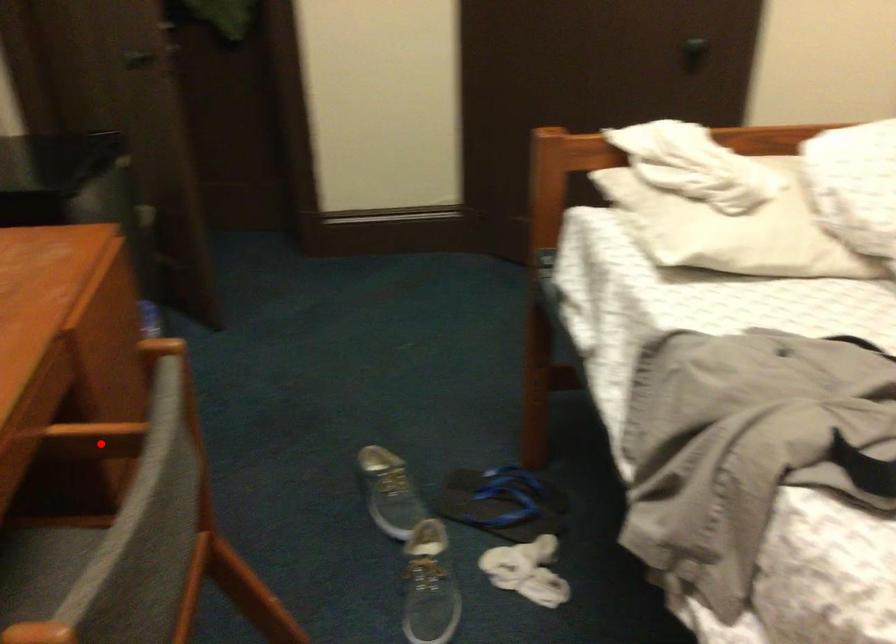
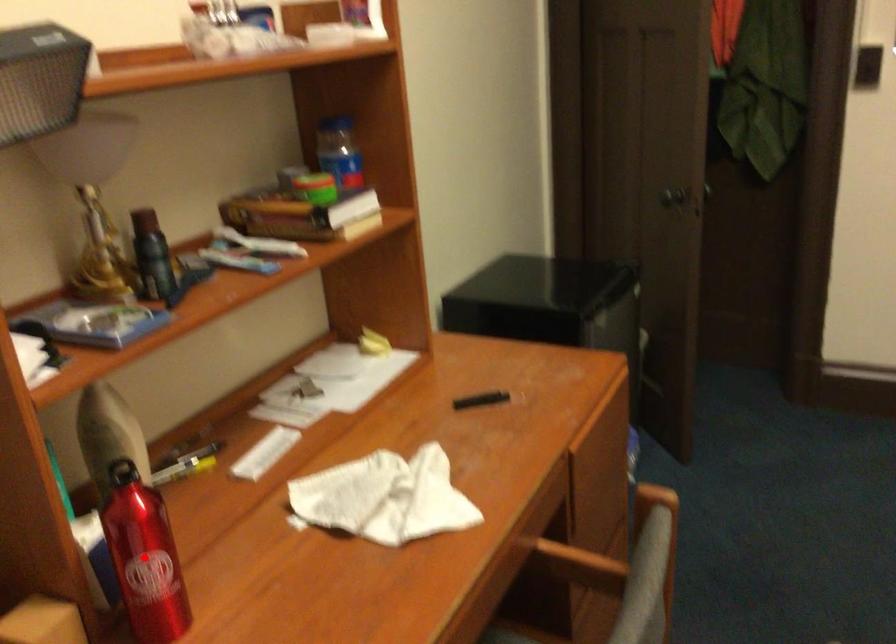
I am providing you with two images of the same scene from different viewpoints. A red point is marked on the first image and another point is marked on the second image. Is the red point in image1 aligned with the point shown in image2?

No